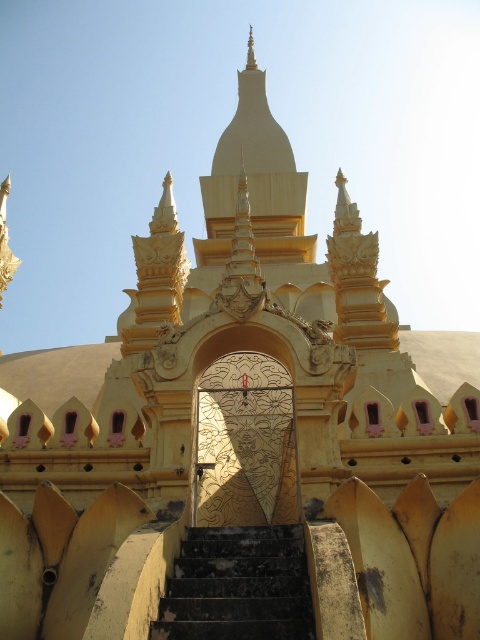
You are a tourist standing at the bottom of the black stone stairs at center, looking up towards the gold textured door at center. Which object is higher in elevation?

The gold textured door at center is higher in elevation than the black stone stairs at center because it is located above them.

You are an architect visiting this temple and need to determine the relative sizes of the entrance and the stairs. Based on the image, which object is narrower between the gold textured door at center and the black stone stairs at center?

The gold textured door at center is narrower than the black stone stairs at center according to the description.